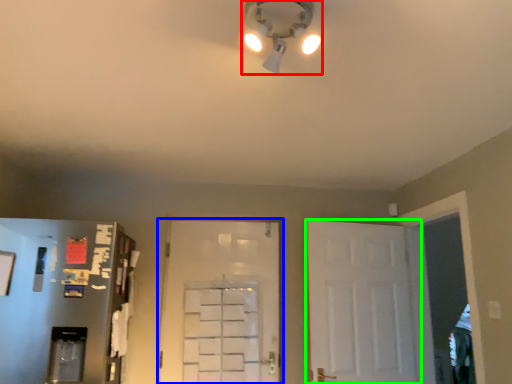
Question: Considering the real-world distances, which object is farthest from light fixture (highlighted by a red box)? door (highlighted by a blue box) or door (highlighted by a green box)?

Choices:
 (A) door
 (B) door

Answer: (A)